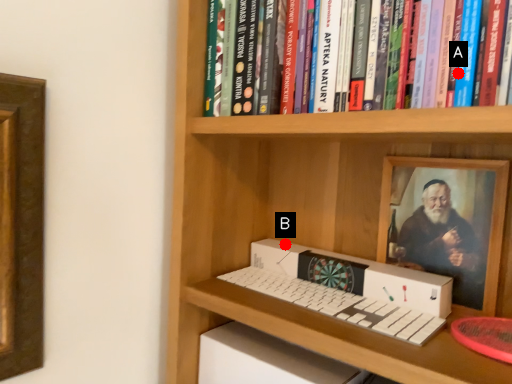
Question: Two points are circled on the image, labeled by A and B beside each circle. Among these points, which one is nearest to the camera?

Choices:
 (A) A is closer
 (B) B is closer

Answer: (A)